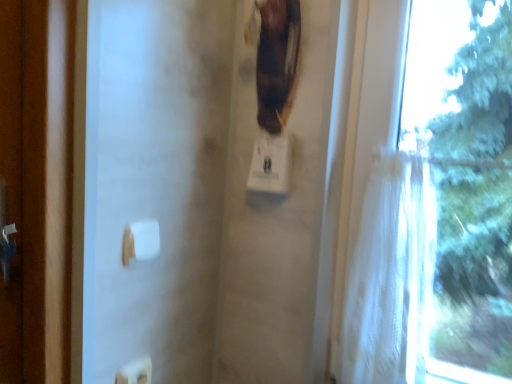
Question: From a real-world perspective, is white sheer curtain at right below brown leather guitar at upper center?

Choices:
 (A) yes
 (B) no

Answer: (A)

Question: Is white sheer curtain at right located outside brown leather guitar at upper center?

Choices:
 (A) no
 (B) yes

Answer: (B)

Question: Does white sheer curtain at right appear on the left side of brown leather guitar at upper center?

Choices:
 (A) no
 (B) yes

Answer: (A)

Question: Considering the relative positions of white sheer curtain at right and brown leather guitar at upper center in the image provided, is white sheer curtain at right to the right of brown leather guitar at upper center from the viewer's perspective?

Choices:
 (A) no
 (B) yes

Answer: (B)

Question: Is white sheer curtain at right bigger than brown leather guitar at upper center?

Choices:
 (A) no
 (B) yes

Answer: (B)

Question: From a real-world perspective, is white sheer curtain at right over brown leather guitar at upper center?

Choices:
 (A) yes
 (B) no

Answer: (B)

Question: Would you say brown leather guitar at upper center is outside white sheer curtain at right?

Choices:
 (A) yes
 (B) no

Answer: (A)

Question: Is brown leather guitar at upper center far from white sheer curtain at right?

Choices:
 (A) no
 (B) yes

Answer: (A)

Question: From a real-world perspective, is brown leather guitar at upper center located higher than white sheer curtain at right?

Choices:
 (A) yes
 (B) no

Answer: (A)

Question: Can you confirm if brown leather guitar at upper center is bigger than white sheer curtain at right?

Choices:
 (A) yes
 (B) no

Answer: (B)

Question: Can you confirm if brown leather guitar at upper center is shorter than white sheer curtain at right?

Choices:
 (A) no
 (B) yes

Answer: (B)

Question: Considering the relative sizes of brown leather guitar at upper center and white sheer curtain at right in the image provided, is brown leather guitar at upper center thinner than white sheer curtain at right?

Choices:
 (A) no
 (B) yes

Answer: (B)

Question: Is white sheer curtain at right in front of white plastic towel bar at lower center?

Choices:
 (A) no
 (B) yes

Answer: (B)